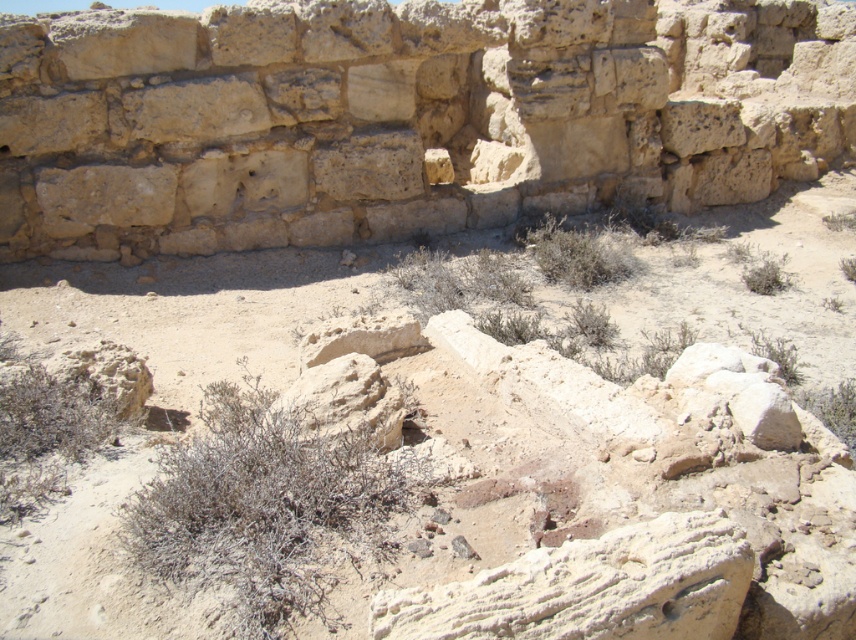
You are standing at the point marked as point (x=260, y=504) in the ancient ruins scene. What can you see directly in front of you?

At point (x=260, y=504) lies dry shrub at center.

You are an archaeologist examining the ancient ruins. You notice a smooth beige rock at center and a green shrub at center. Which object is shorter in height?

The smooth beige rock at center is not as tall as the green shrub at center, so the smooth beige rock at center is shorter in height.

You are an archaeologist examining the ancient ruins. You need to place a marker at the exact center of the smooth beige rock at center. What are the coordinates where you should place the marker?

The coordinates for the smooth beige rock at center are at point (346,400), so you should place the marker there.